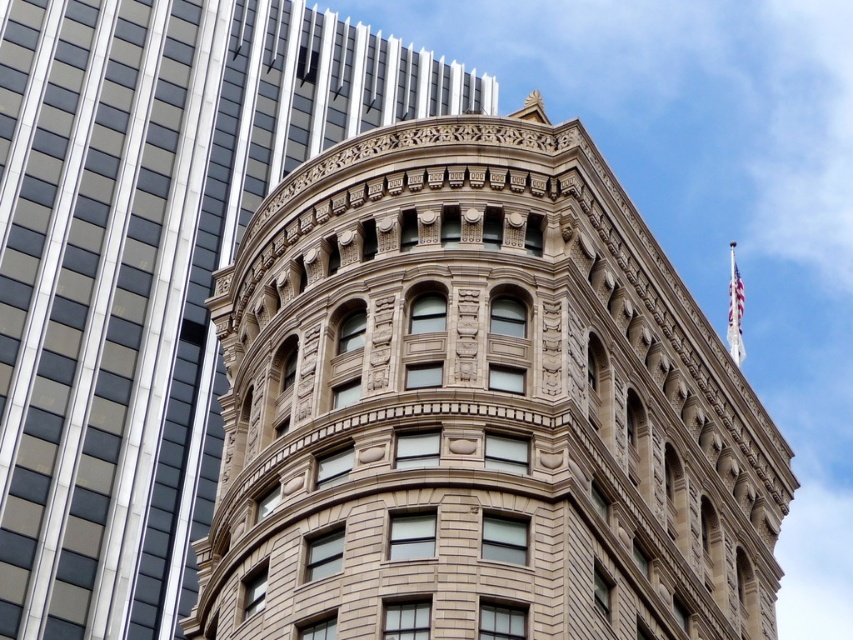
Question: Which object appears farthest from the camera in this image?

Choices:
 (A) brown stone tower at center
 (B) brown stone building at center

Answer: (B)

Question: Can you confirm if brown stone tower at center is positioned below brown stone building at center?

Choices:
 (A) yes
 (B) no

Answer: (A)

Question: Can you confirm if brown stone tower at center is bigger than brown stone building at center?

Choices:
 (A) no
 (B) yes

Answer: (A)

Question: Which point is closer to the camera?

Choices:
 (A) brown stone tower at center
 (B) brown stone building at center

Answer: (A)

Question: Is brown stone tower at center wider than brown stone building at center?

Choices:
 (A) no
 (B) yes

Answer: (A)